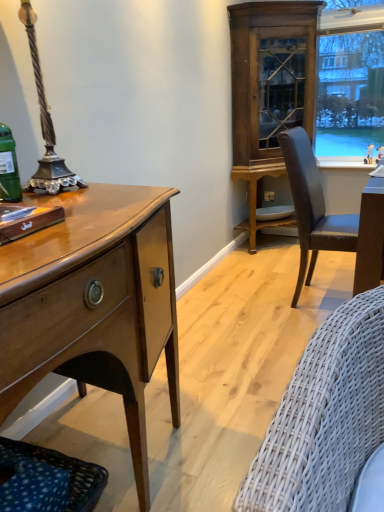
The width and height of the screenshot is (384, 512). I want to click on free spot above white glossy plate at lower center (from a real-world perspective), so click(x=273, y=210).